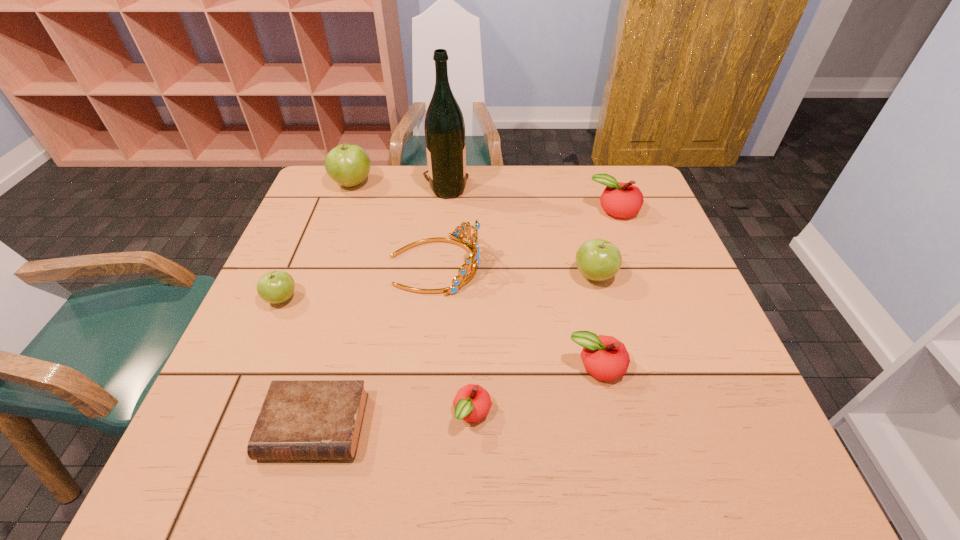
This screenshot has height=540, width=960. I want to click on wine bottle, so click(x=444, y=127).

I want to click on the biggest green apple, so click(347, 164).

You are a GUI agent. You are given a task and a screenshot of the screen. Output one action in this format:
    pyautogui.click(x=<x>, y=<y>)
    Task: Click on the tallest apple
    Image resolution: width=960 pixels, height=540 pixels.
    Given the screenshot: What is the action you would take?
    pyautogui.click(x=347, y=164)

This screenshot has height=540, width=960. What are the coordinates of `tiara` in the screenshot? It's located at (473, 248).

Where is `the second smallest green apple`? Image resolution: width=960 pixels, height=540 pixels. the second smallest green apple is located at coordinates (597, 259).

The height and width of the screenshot is (540, 960). Identify the location of the rightmost green apple. (597, 259).

Find the location of a particular element. The height and width of the screenshot is (540, 960). the farthest red apple is located at coordinates (623, 200).

Find the location of a particular element. The height and width of the screenshot is (540, 960). the rightmost red apple is located at coordinates (623, 200).

This screenshot has width=960, height=540. I want to click on the smallest green apple, so click(275, 287).

I want to click on the second nearest apple, so click(x=605, y=358).